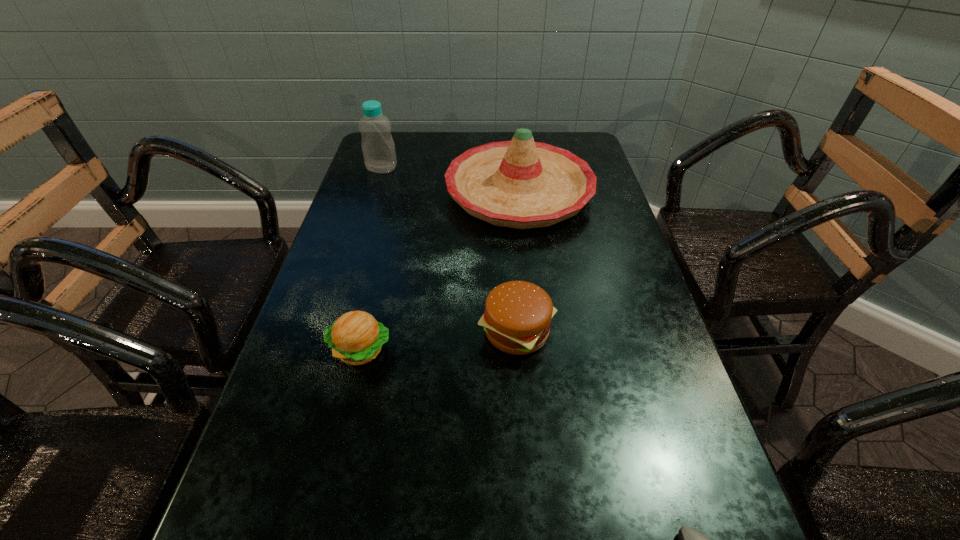
Locate an element on the screen. Image resolution: width=960 pixels, height=540 pixels. free point that satisfies the following two spatial constraints: 1. on the back side of the right hamburger; 2. on the right side of the sombrero is located at coordinates (506, 192).

I want to click on vacant space that satisfies the following two spatial constraints: 1. on the front side of the sombrero; 2. on the left side of the bottle, so click(x=374, y=192).

The width and height of the screenshot is (960, 540). Find the location of `vacant space that satisfies the following two spatial constraints: 1. on the front side of the sombrero; 2. on the left side of the bottle`. vacant space that satisfies the following two spatial constraints: 1. on the front side of the sombrero; 2. on the left side of the bottle is located at coordinates (374, 192).